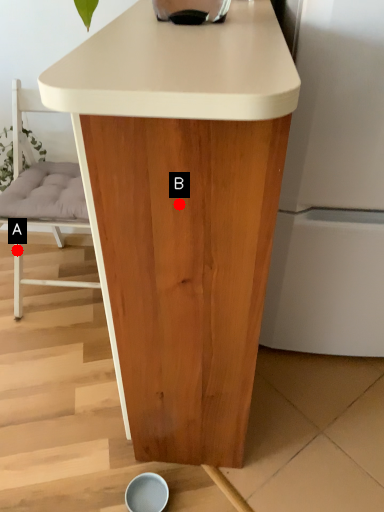
Question: Two points are circled on the image, labeled by A and B beside each circle. Which point is closer to the camera taking this photo?

Choices:
 (A) A is closer
 (B) B is closer

Answer: (B)